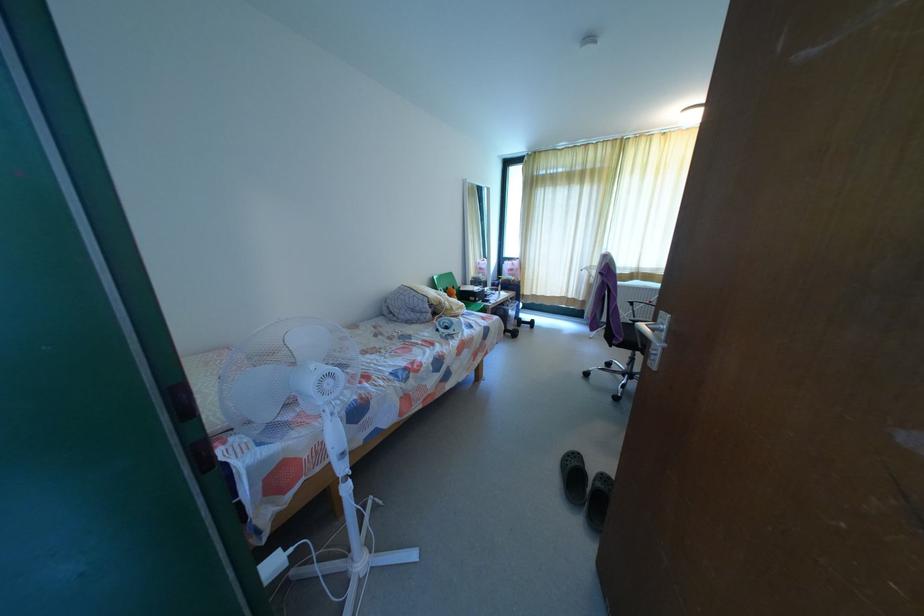
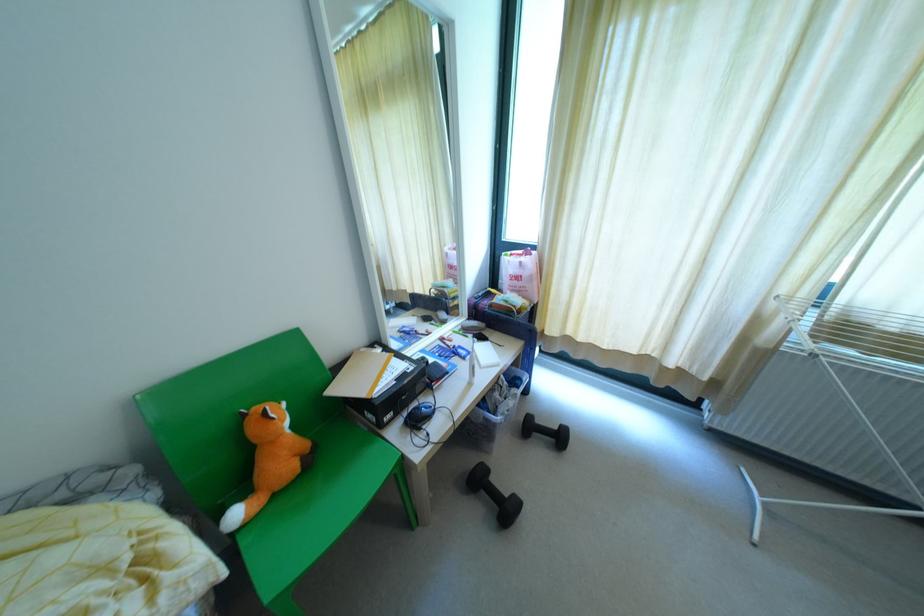
Where in the second image is the point corresponding to pixel 568 296 from the first image?

(670, 363)